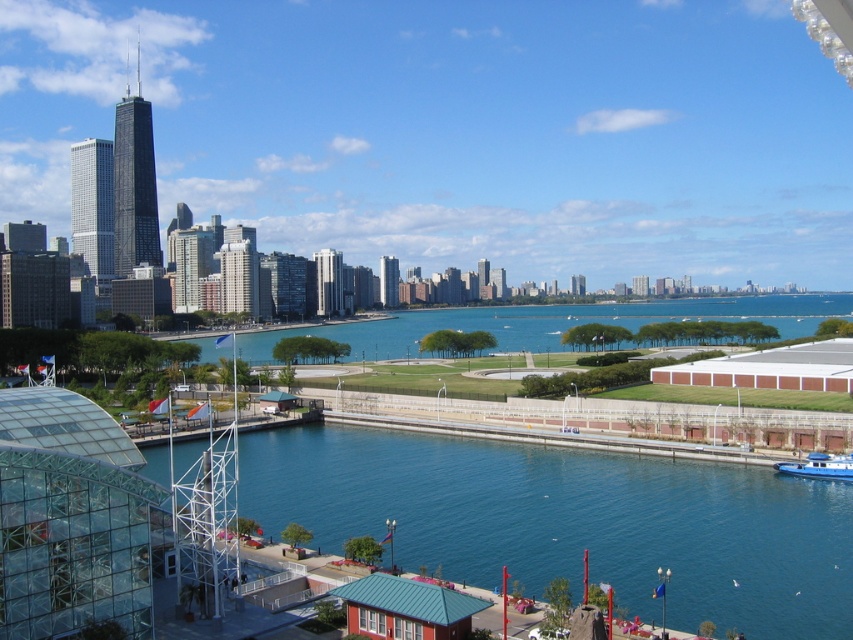
Is blue glassy water at lower center above blue water at center?

Incorrect, blue glassy water at lower center is not positioned above blue water at center.

Between blue glassy water at lower center and blue water at center, which one has more height?

blue water at center is taller.

This screenshot has width=853, height=640. Find the location of `blue glassy water at lower center`. blue glassy water at lower center is located at coordinates (570, 522).

Consider the image. Is blue glassy water at lower center below blue matte boat at lower right?

Yes.

Where is `blue glassy water at lower center`? The height and width of the screenshot is (640, 853). blue glassy water at lower center is located at coordinates (570, 522).

Identify the location of blue glassy water at lower center. (570, 522).

Does blue water at center appear on the left side of blue matte boat at lower right?

Incorrect, blue water at center is not on the left side of blue matte boat at lower right.

Which of these two, blue water at center or blue matte boat at lower right, stands shorter?

Standing shorter between the two is blue matte boat at lower right.

Identify the location of blue water at center. (552, 323).

Where is `blue water at center`? The height and width of the screenshot is (640, 853). blue water at center is located at coordinates (552, 323).